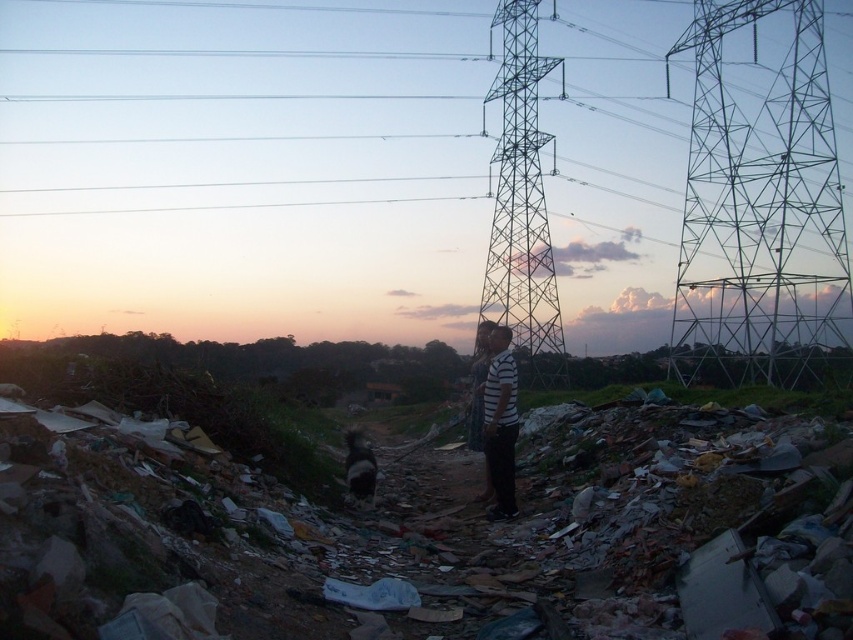
Based on the scene description, which object is bigger between the metallic grid structure at upper right and the metallic structure at center?

The metallic grid structure at upper right is larger in size than the metallic structure at center.